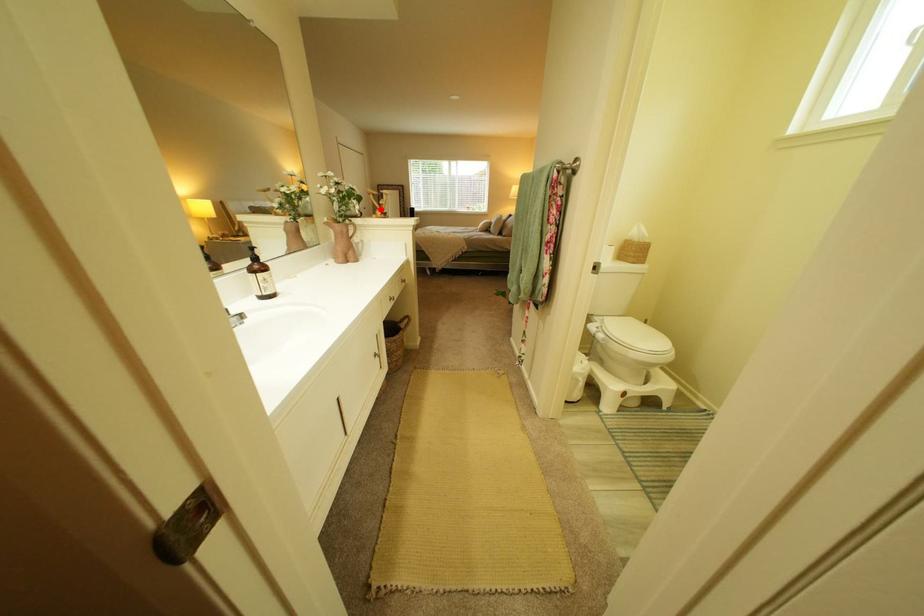
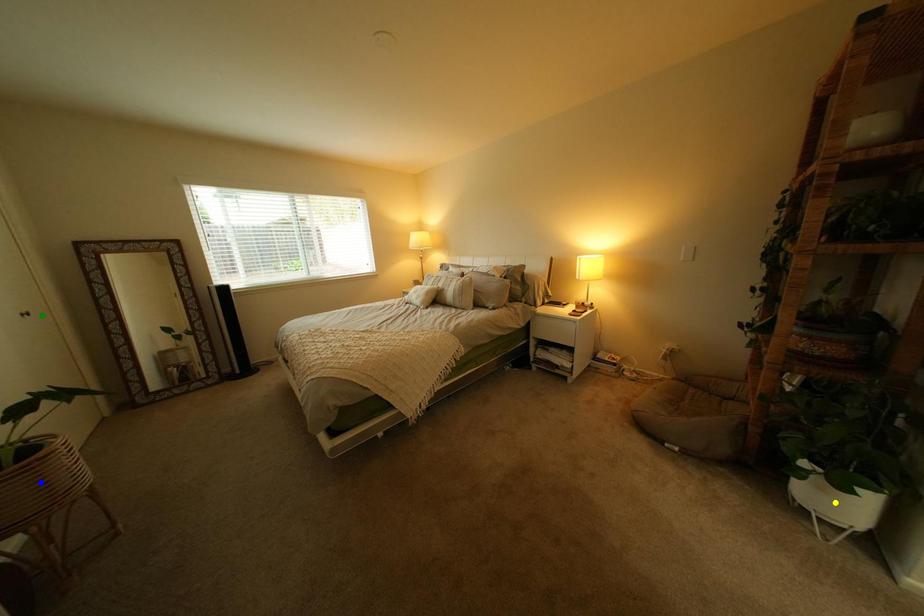
Question: I am providing you with two images of the same scene from different viewpoints. A red point is marked on the first image. You are given multiple points on the second image. Which point in image 2 represents the same 3d spot as the red point in image 1?

Choices:
 (A) yellow point
 (B) blue point
 (C) green point

Answer: (C)